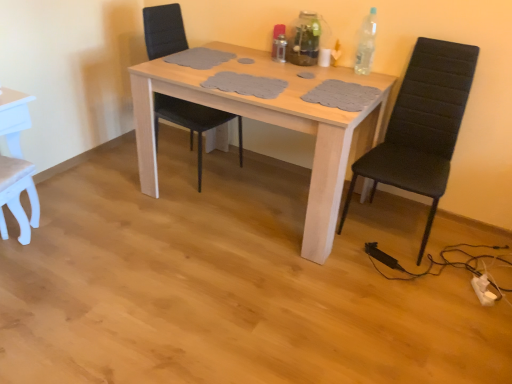
Where is `free space that is in between white matte chair at lower left, which ranks as the first chair in left-to-right order, and light wood table at center`? The height and width of the screenshot is (384, 512). free space that is in between white matte chair at lower left, which ranks as the first chair in left-to-right order, and light wood table at center is located at coordinates (156, 244).